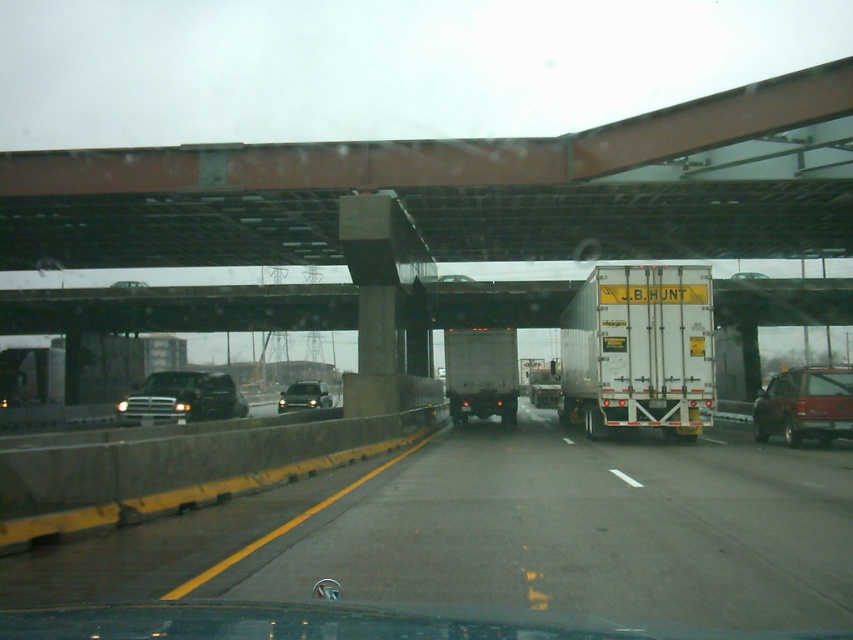
Is point (581, 339) less distant than point (302, 390)?

Yes.

Can you confirm if white matte trailer truck at center is positioned below matte black suv at center?

Incorrect, white matte trailer truck at center is not positioned below matte black suv at center.

You are a GUI agent. You are given a task and a screenshot of the screen. Output one action in this format:
    pyautogui.click(x=<x>, y=<y>)
    Task: Click on the white matte trailer truck at center
    The height and width of the screenshot is (640, 853).
    Given the screenshot: What is the action you would take?
    pyautogui.click(x=639, y=349)

In the scene shown: Does matte gray truck at center have a greater width compared to matte black truck at left?

No, matte gray truck at center is not wider than matte black truck at left.

Is matte gray truck at center smaller than matte black truck at left?

Indeed, matte gray truck at center has a smaller size compared to matte black truck at left.

Locate an element on the screen. matte gray truck at center is located at coordinates point(480,372).

Image resolution: width=853 pixels, height=640 pixels. I want to click on matte red suv at right, so click(805, 404).

Locate an element on the screen. matte red suv at right is located at coordinates (805, 404).